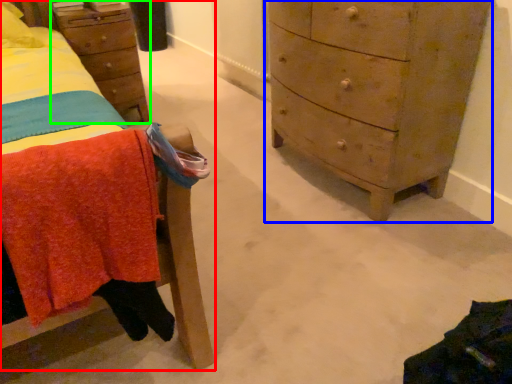
Question: Which object is the closest to the furniture (highlighted by a red box)? Choose among these: chest of drawers (highlighted by a blue box) or nightstand (highlighted by a green box).

Choices:
 (A) chest of drawers
 (B) nightstand

Answer: (B)